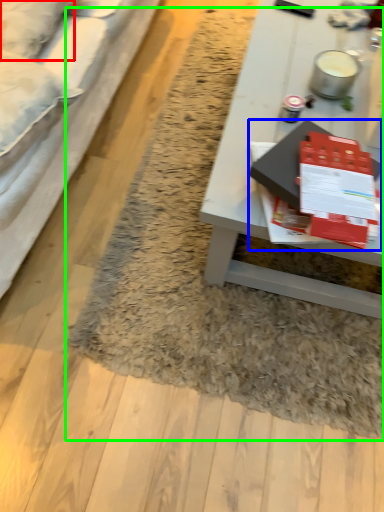
Question: Which is nearer to the pillow (highlighted by a red box)? magazine (highlighted by a blue box) or mat (highlighted by a green box).

Choices:
 (A) magazine
 (B) mat

Answer: (A)